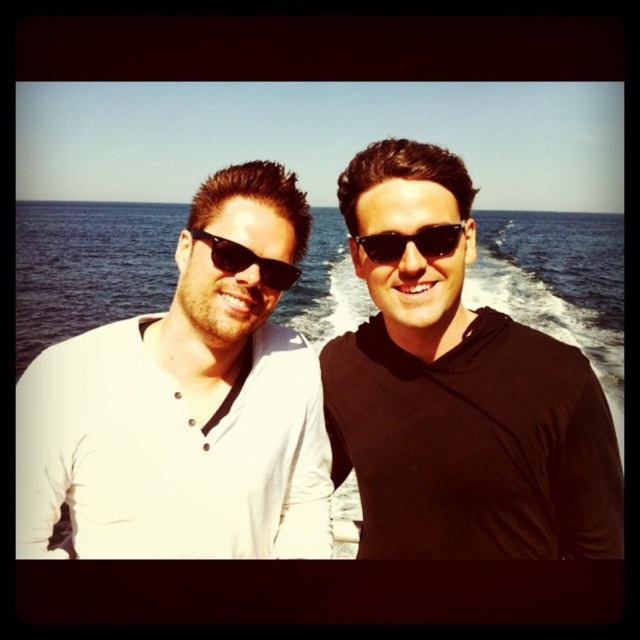
Question: Does white matte shirt at center lie in front of blue water at center?

Choices:
 (A) yes
 (B) no

Answer: (A)

Question: Is blue water at center above black plastic sunglasses at center?

Choices:
 (A) yes
 (B) no

Answer: (A)

Question: Does white matte shirt at left have a lesser width compared to blue water at center?

Choices:
 (A) yes
 (B) no

Answer: (A)

Question: Which of the following is the closest to the observer?

Choices:
 (A) (289, 284)
 (B) (340, 392)
 (C) (456, 234)
 (D) (216, 264)

Answer: (C)

Question: Among these points, which one is nearest to the camera?

Choices:
 (A) (161, 429)
 (B) (212, 264)
 (C) (240, 243)
 (D) (52, 326)

Answer: (C)

Question: Which point is closer to the camera?

Choices:
 (A) matte black sunglasses at left
 (B) black plastic sunglasses at center
 (C) white matte shirt at center

Answer: (C)